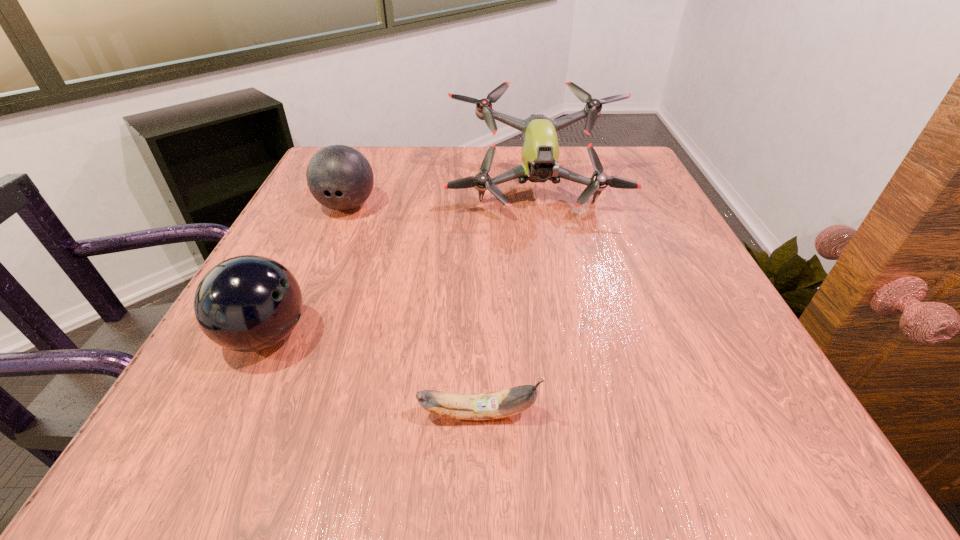
Where is `vacant space at the near left corner`? vacant space at the near left corner is located at coordinates (253, 464).

Where is `blank space at the far right corner`? This screenshot has height=540, width=960. blank space at the far right corner is located at coordinates (607, 188).

The image size is (960, 540). Find the location of `vacant space that is in between the farther bowling ball and the shortest object`. vacant space that is in between the farther bowling ball and the shortest object is located at coordinates (413, 310).

This screenshot has width=960, height=540. In order to click on free spot between the third farthest object and the tallest object in this screenshot , I will do `click(400, 265)`.

The image size is (960, 540). In order to click on free point between the banana and the farther bowling ball in this screenshot , I will do `click(413, 310)`.

Image resolution: width=960 pixels, height=540 pixels. I want to click on free spot between the farther bowling ball and the drone, so click(x=442, y=200).

The height and width of the screenshot is (540, 960). Find the location of `free space between the tallest object and the nearer bowling ball`. free space between the tallest object and the nearer bowling ball is located at coordinates (400, 265).

Locate an element on the screen. The image size is (960, 540). empty space between the second nearest object and the drone is located at coordinates (400, 265).

You are a GUI agent. You are given a task and a screenshot of the screen. Output one action in this format:
    pyautogui.click(x=<x>, y=<y>)
    Task: Click on the free space between the banana and the third farthest object
    This screenshot has height=540, width=960.
    Given the screenshot: What is the action you would take?
    pyautogui.click(x=372, y=375)

The height and width of the screenshot is (540, 960). I want to click on unoccupied area between the farther bowling ball and the banana, so click(x=413, y=310).